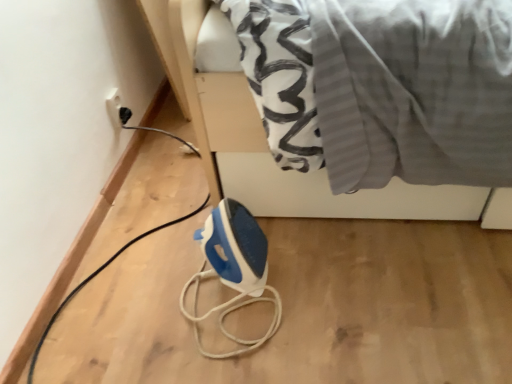
Question: Can you confirm if blue plastic iron at lower center is taller than white glossy bed at upper center?

Choices:
 (A) no
 (B) yes

Answer: (A)

Question: Is blue plastic iron at lower center next to white glossy bed at upper center and touching it?

Choices:
 (A) no
 (B) yes

Answer: (A)

Question: Does blue plastic iron at lower center appear on the left side of white glossy bed at upper center?

Choices:
 (A) yes
 (B) no

Answer: (A)

Question: Can white glossy bed at upper center be found inside blue plastic iron at lower center?

Choices:
 (A) no
 (B) yes

Answer: (A)

Question: From the image's perspective, is blue plastic iron at lower center located above white glossy bed at upper center?

Choices:
 (A) yes
 (B) no

Answer: (B)

Question: Is blue plastic iron at lower center thinner than white glossy bed at upper center?

Choices:
 (A) no
 (B) yes

Answer: (B)

Question: Is blue plastic iron at lower center smaller than white plastic socket at upper left?

Choices:
 (A) yes
 (B) no

Answer: (B)

Question: Could white plastic socket at upper left be considered to be inside blue plastic iron at lower center?

Choices:
 (A) no
 (B) yes

Answer: (A)

Question: Would you say blue plastic iron at lower center is a long distance from white plastic socket at upper left?

Choices:
 (A) yes
 (B) no

Answer: (B)

Question: Is blue plastic iron at lower center at the right side of white plastic socket at upper left?

Choices:
 (A) yes
 (B) no

Answer: (A)

Question: Considering the relative sizes of blue plastic iron at lower center and white plastic socket at upper left in the image provided, is blue plastic iron at lower center wider than white plastic socket at upper left?

Choices:
 (A) yes
 (B) no

Answer: (A)

Question: Is blue plastic iron at lower center completely or partially outside of white plastic socket at upper left?

Choices:
 (A) yes
 (B) no

Answer: (A)

Question: Considering the relative positions of white plastic socket at upper left and white glossy bed at upper center in the image provided, is white plastic socket at upper left to the left of white glossy bed at upper center from the viewer's perspective?

Choices:
 (A) no
 (B) yes

Answer: (B)